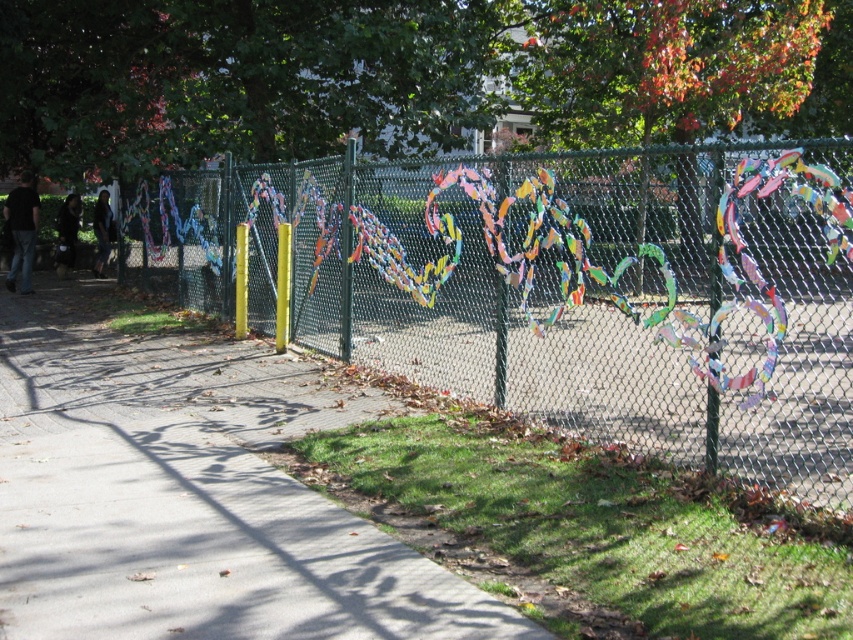
Is point (759, 228) closer to viewer compared to point (286, 577)?

No, it is not.

Is green chain-link fence at center thinner than gray concrete pavement at lower left?

Incorrect, green chain-link fence at center's width is not less than gray concrete pavement at lower left's.

What do you see at coordinates (555, 285) in the screenshot? This screenshot has width=853, height=640. I see `green chain-link fence at center` at bounding box center [555, 285].

Locate an element on the screen. green chain-link fence at center is located at coordinates (555, 285).